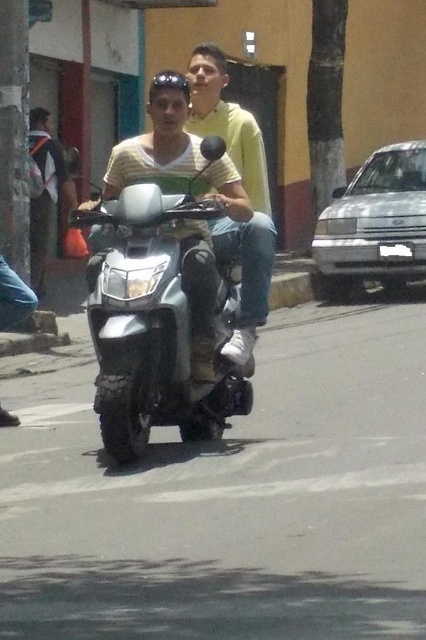
Based on the photo, between silver metallic scooter at center and yellow-green shirt at center, which one has less height?

Standing shorter between the two is silver metallic scooter at center.

Is point (186, 312) behind point (232, 148)?

No, (186, 312) is in front of (232, 148).

Identify the location of silver metallic scooter at center. (158, 321).